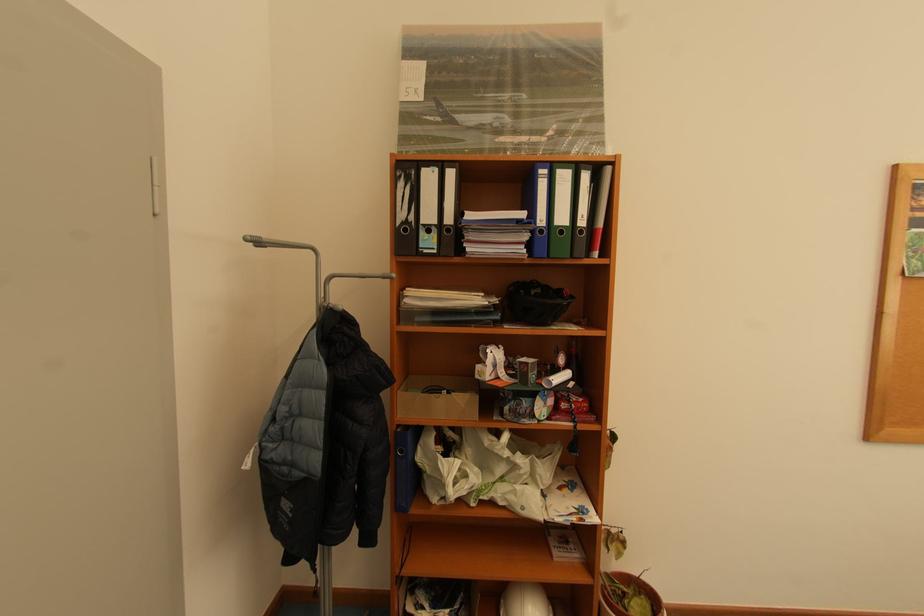
Where is `blue binder finger hole`? blue binder finger hole is located at coordinates (403, 447).